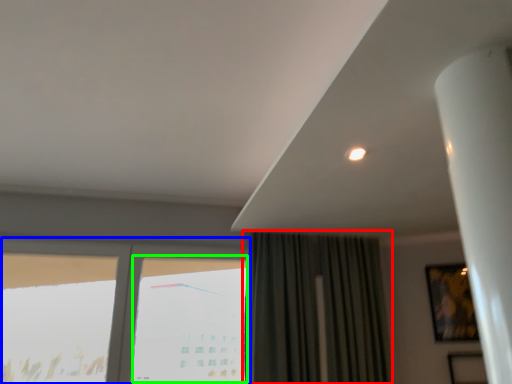
Question: Which is farther away from curtain (highlighted by a red box)? window (highlighted by a blue box) or window (highlighted by a green box)?

Choices:
 (A) window
 (B) window

Answer: (A)